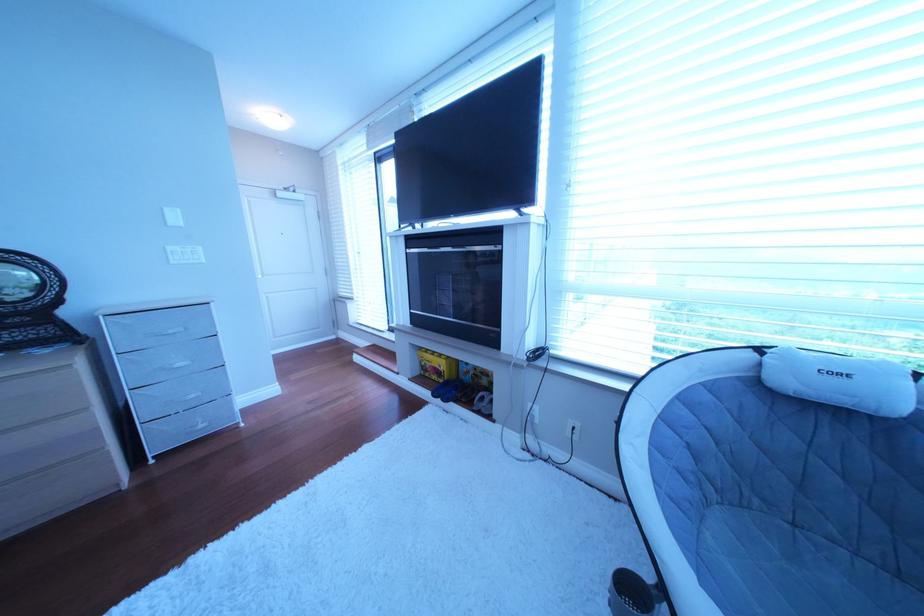
Locate an element on the screen. The width and height of the screenshot is (924, 616). blue croc-style shoe is located at coordinates (446, 390).